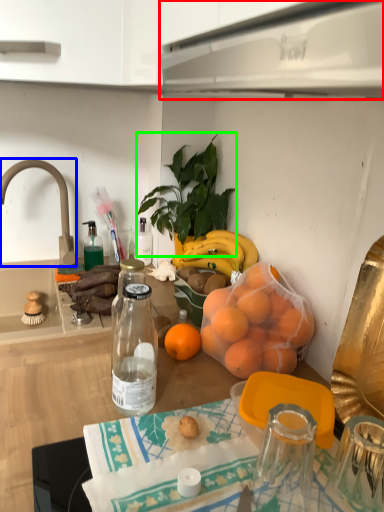
Question: Based on their relative distances, which object is farther from kitchen appliance (highlighted by a red box)? Choose from faucet (highlighted by a blue box) and houseplant (highlighted by a green box).

Choices:
 (A) faucet
 (B) houseplant

Answer: (A)